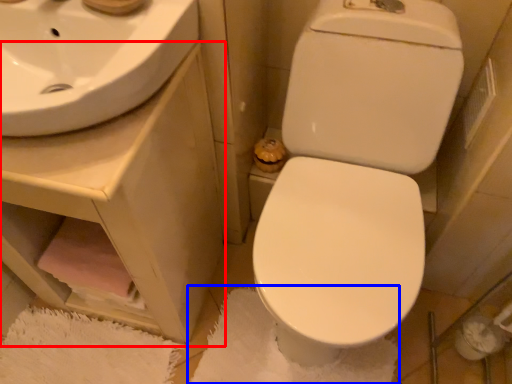
Question: Among these objects, which one is nearest to the camera, counter top (highlighted by a red box) or bath mat (highlighted by a blue box)?

Choices:
 (A) counter top
 (B) bath mat

Answer: (A)